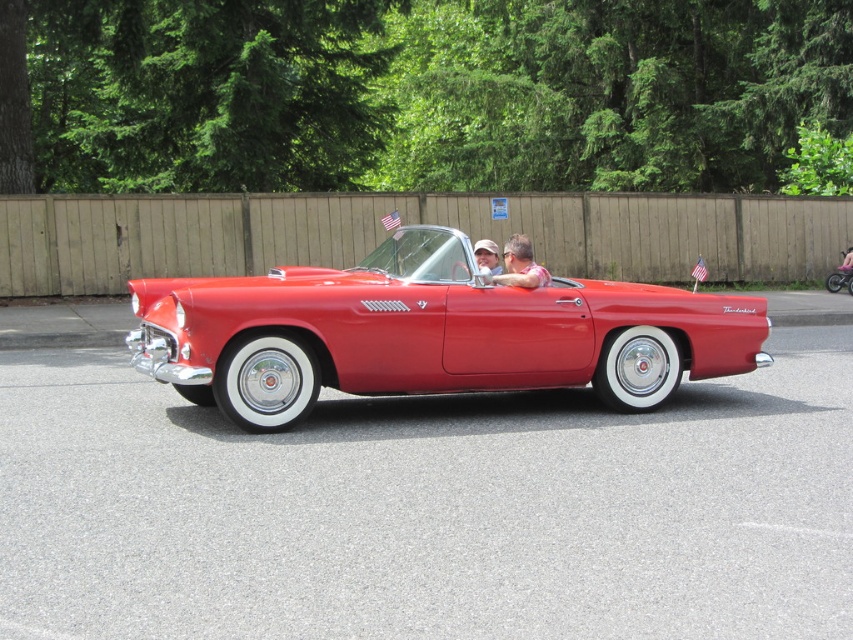
Question: Which point is farther to the camera?

Choices:
 (A) (709, 326)
 (B) (518, 276)

Answer: (A)

Question: Is shiny red convertible at center further to camera compared to matte black sunglasses at center?

Choices:
 (A) yes
 (B) no

Answer: (B)

Question: Can you confirm if shiny red convertible at center is wider than matte black sunglasses at center?

Choices:
 (A) no
 (B) yes

Answer: (B)

Question: Does shiny red convertible at center have a lesser width compared to matte black sunglasses at center?

Choices:
 (A) yes
 (B) no

Answer: (B)

Question: Among these points, which one is farthest from the camera?

Choices:
 (A) (448, 369)
 (B) (521, 243)

Answer: (B)